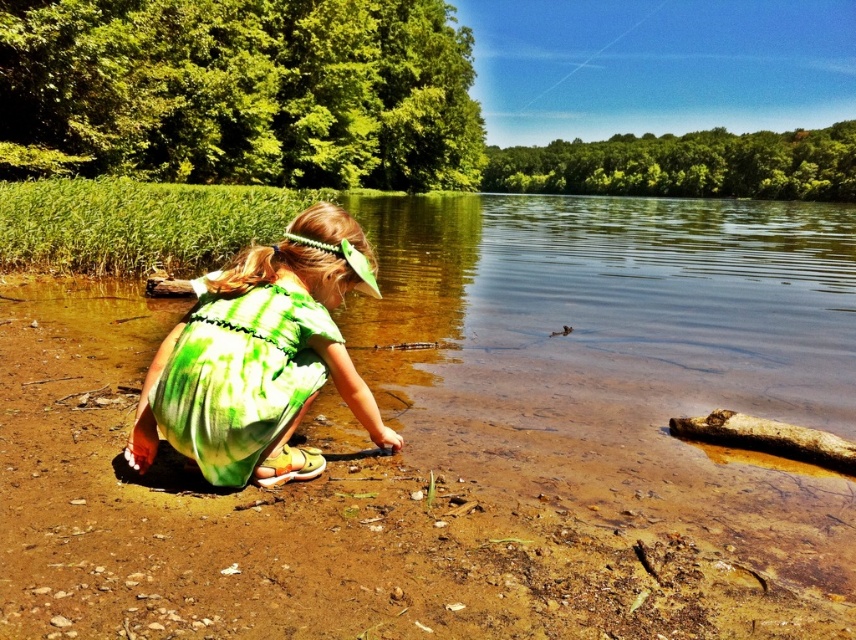
Question: Which point appears farthest from the camera in this image?

Choices:
 (A) (744, 413)
 (B) (250, 310)
 (C) (488, 440)

Answer: (A)

Question: Which point is closer to the camera?

Choices:
 (A) (742, 444)
 (B) (296, 412)
 (C) (24, 536)

Answer: (C)

Question: Which point is closer to the camera taking this photo?

Choices:
 (A) click(x=580, y=420)
 (B) click(x=711, y=442)
 (C) click(x=296, y=392)

Answer: (C)

Question: Can you confirm if brown dirt at lower left is positioned below green tie-dye dress at lower center?

Choices:
 (A) yes
 (B) no

Answer: (A)

Question: Is brown dirt at lower left smaller than brown rough log at lower right?

Choices:
 (A) yes
 (B) no

Answer: (B)

Question: Can you confirm if brown dirt at lower left is positioned to the right of green tie-dye dress at lower center?

Choices:
 (A) yes
 (B) no

Answer: (A)